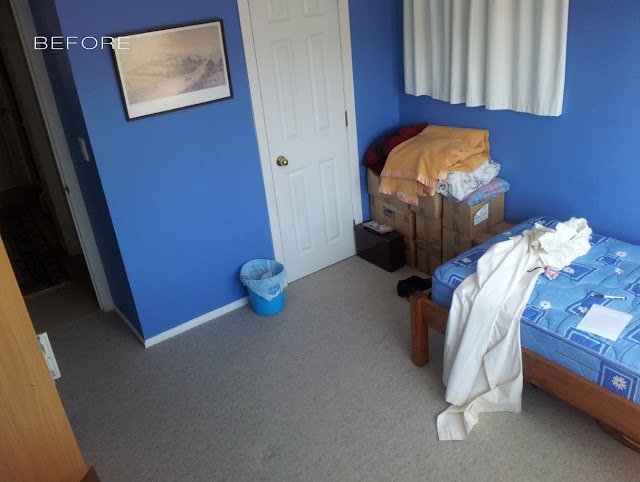
Locate an element on the screen. The height and width of the screenshot is (482, 640). mattress is located at coordinates (589, 362).